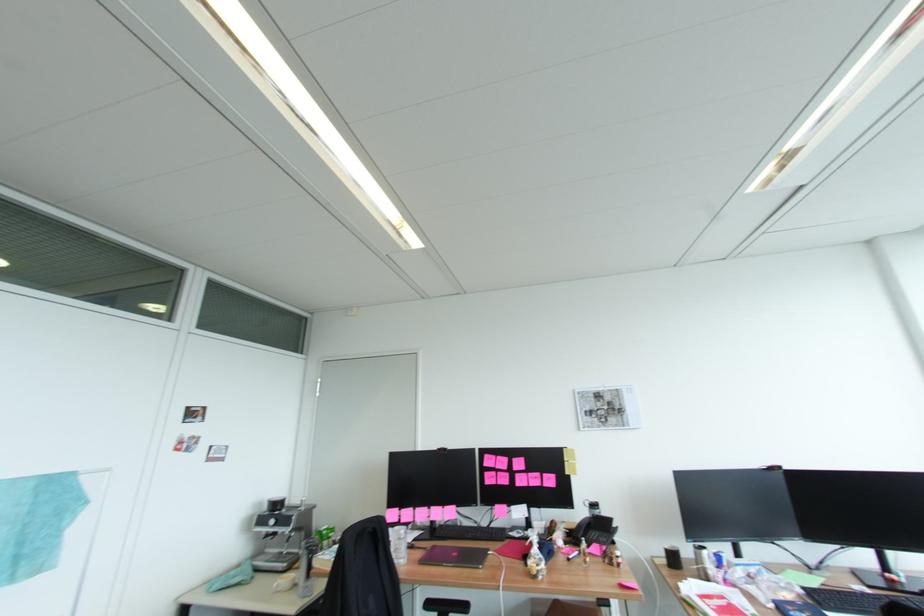
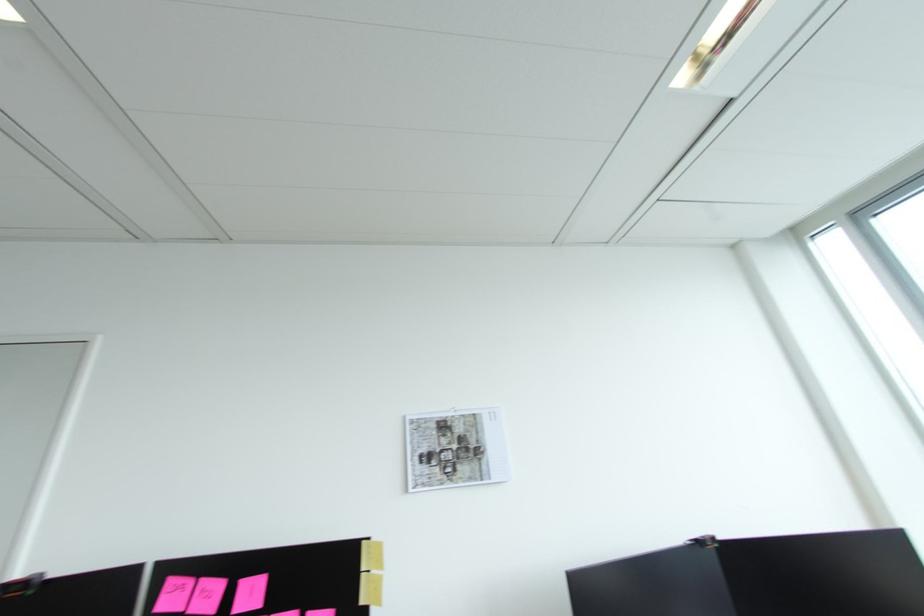
Where in the second image is the point corresponding to [611,408] from the first image?

(459, 446)